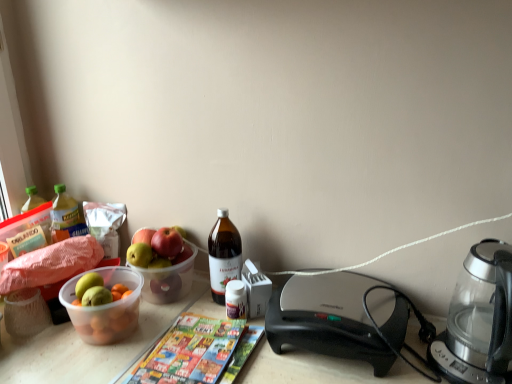
Question: From the image's perspective, is transparent glass coffee maker at right above or below multicolored glossy magazine at center?

Choices:
 (A) below
 (B) above

Answer: (B)

Question: Does point (430, 347) appear closer or farther from the camera than point (202, 382)?

Choices:
 (A) farther
 (B) closer

Answer: (A)

Question: Based on their relative distances, which object is nearer to the multicolored glossy magazine at center?

Choices:
 (A) translucent plastic bottle at left, positioned as the 1th bottle in left-to-right order
 (B) translucent plastic bowl at left
 (C) black plastic sandwich maker at center
 (D) transparent glass coffee maker at right
 (E) translucent glass bottle at center, the first bottle viewed from the front

Answer: (E)

Question: Estimate the real-world distances between objects in this image. Which object is closer to the black plastic sandwich maker at center?

Choices:
 (A) translucent plastic bowl at left
 (B) translucent glass bottle at center, the second bottle positioned from the back
 (C) multicolored glossy magazine at center
 (D) transparent glass coffee maker at right
 (E) translucent plastic bottle at left, the first bottle from the back

Answer: (D)